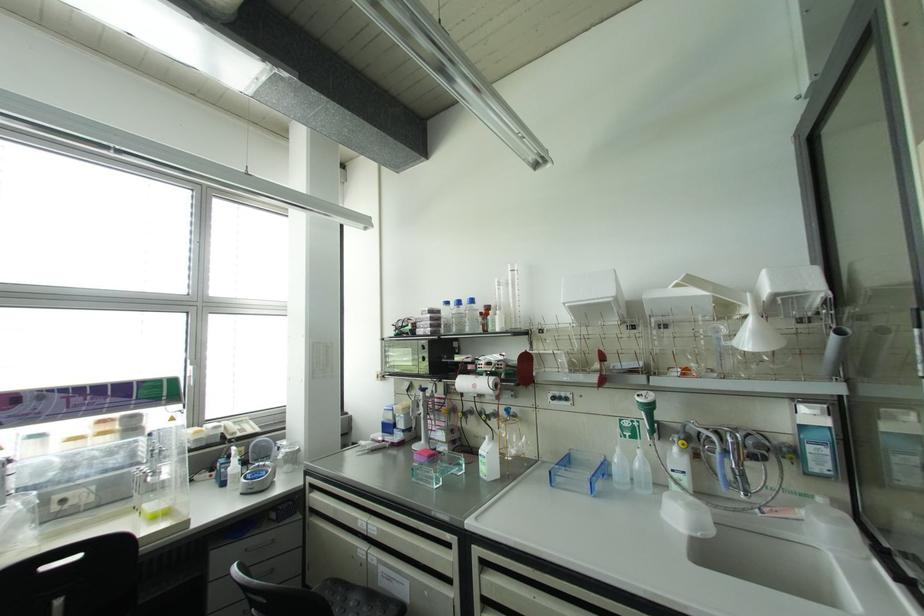
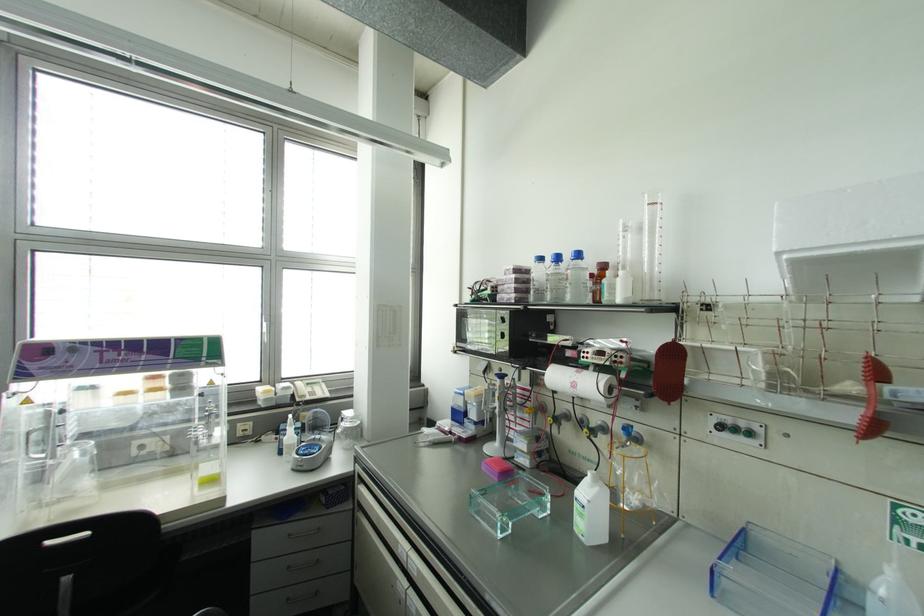
Question: The camera is either moving clockwise (left) or counter-clockwise (right) around the object. The first image is from the beginning of the video and the second image is from the end. Is the camera moving left or right when shooting the video?

Choices:
 (A) Left
 (B) Right

Answer: (B)